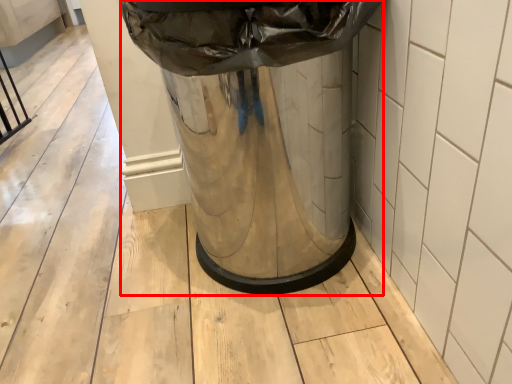
Question: From the image's perspective, where is waste container (annotated by the red box) located relative to tile?

Choices:
 (A) below
 (B) above

Answer: (B)